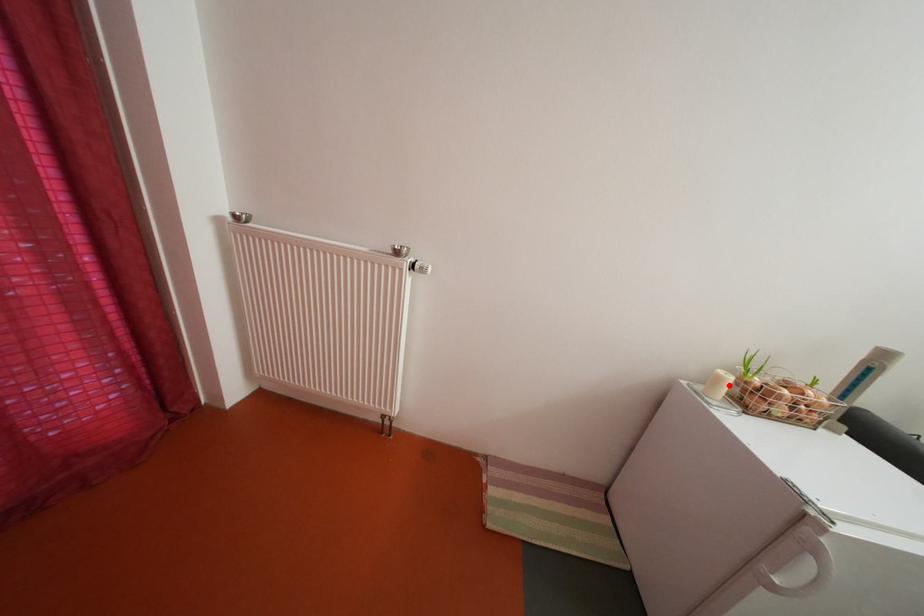
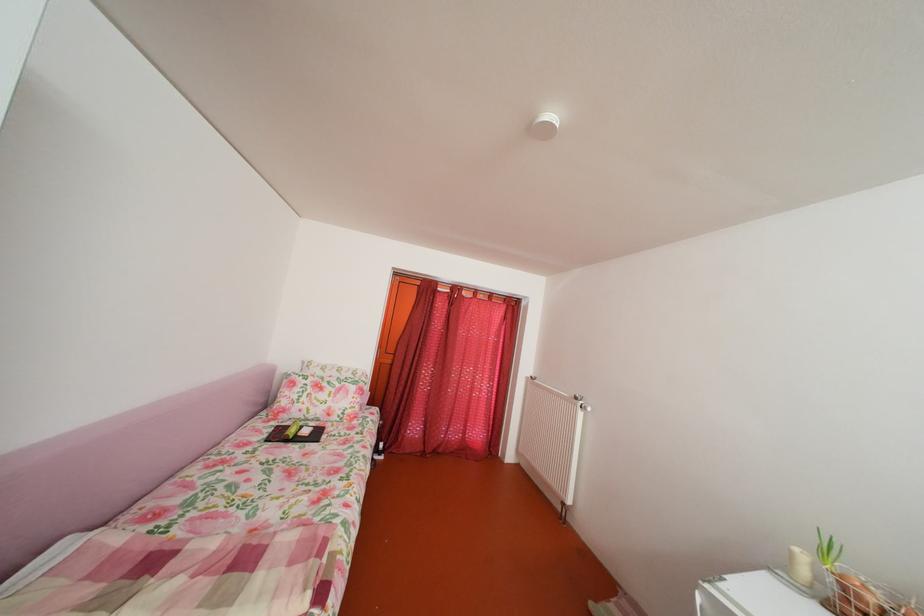
Question: I am providing you with two images of the same scene from different viewpoints. A red point is marked on the first image. At the location where the point appears in image 1, is it still visible in image 2?

Choices:
 (A) Yes
 (B) No

Answer: (A)